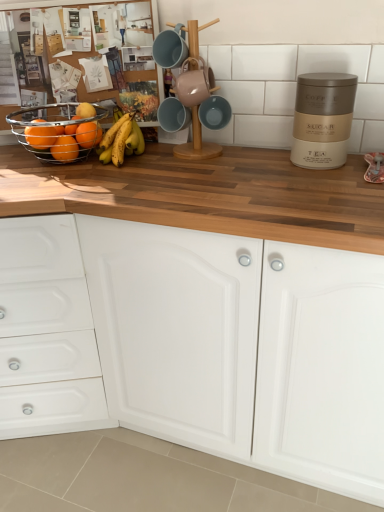
The height and width of the screenshot is (512, 384). In order to click on free point above white matte cabinet at center (from a real-world perspective) in this screenshot , I will do `click(248, 179)`.